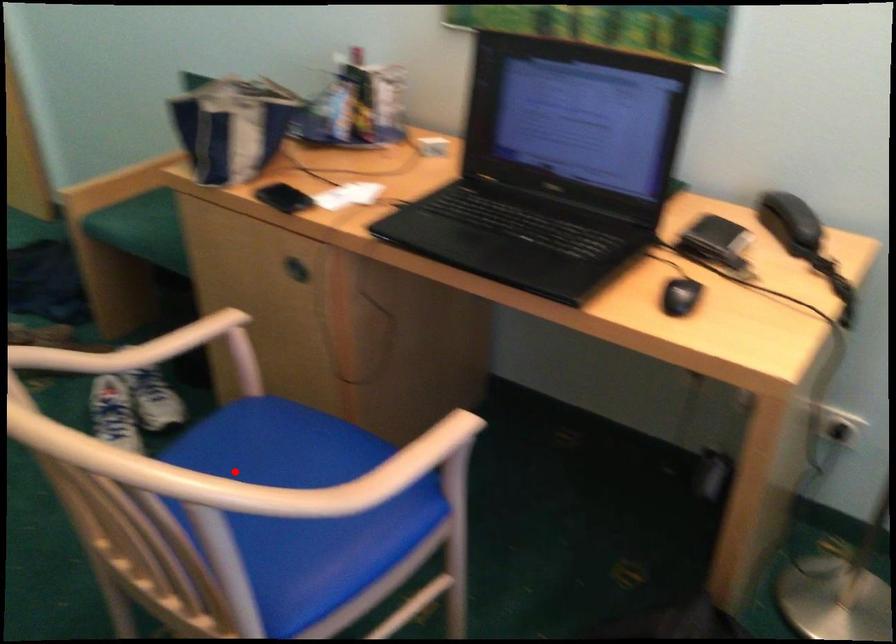
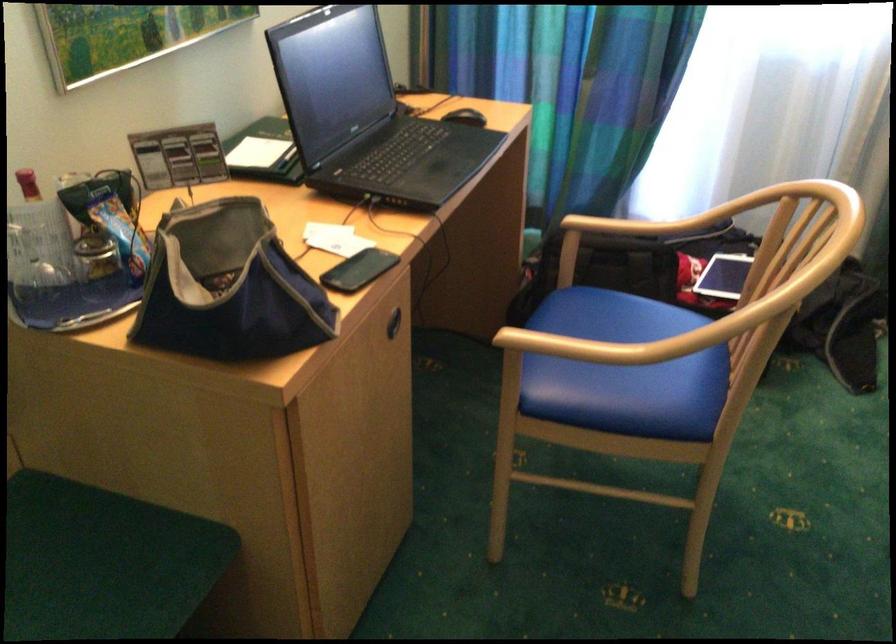
Find the pixel in the second image that matches the highlighted location in the first image.

(624, 370)